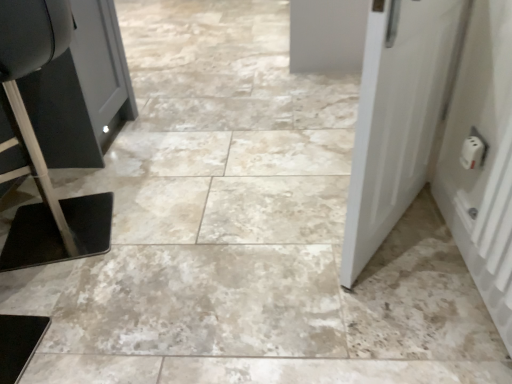
Locate an element on the screen. The height and width of the screenshot is (384, 512). free point to the left of white matte door at right, the first door in the left-to-right sequence is located at coordinates (266, 236).